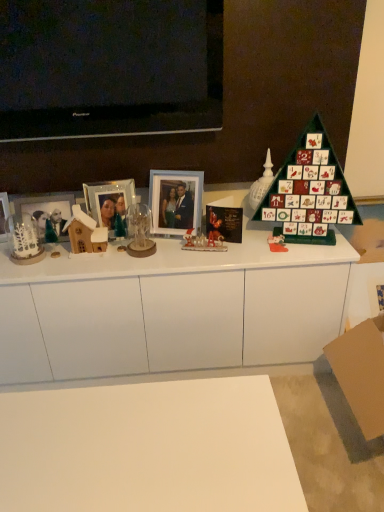
I want to click on free space between clear glass ornament at center, arranged as the third toy when viewed from the left, and white glossy santa claus at center, the 3th toy in the right-to-left sequence, so click(177, 250).